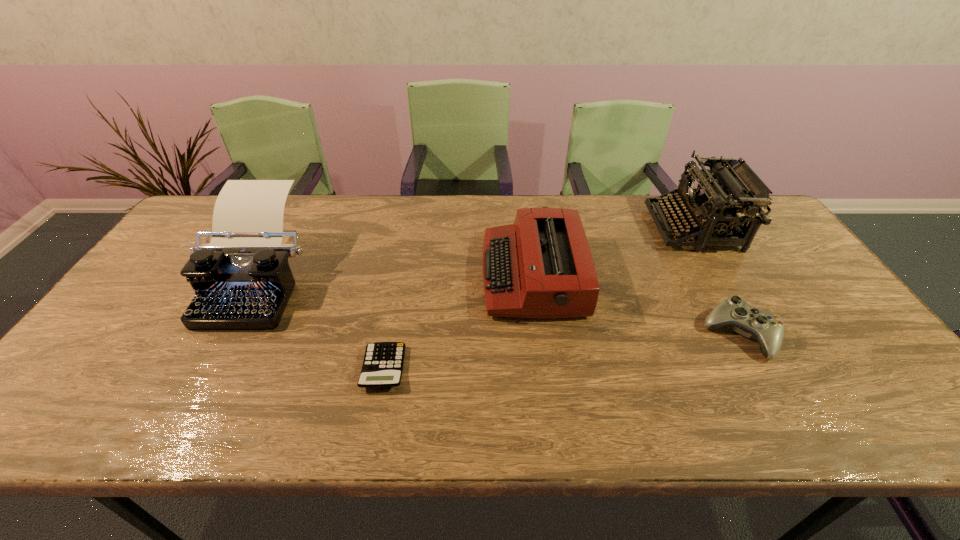
The width and height of the screenshot is (960, 540). I want to click on the rightmost typewriter, so click(x=731, y=187).

At what (x,y) coordinates should I click in order to perform the action: click on the leftmost typewriter. Please return your answer as a coordinate pair (x, y). Looking at the image, I should click on (242, 280).

Where is `the shortest typewriter`? This screenshot has width=960, height=540. the shortest typewriter is located at coordinates (541, 266).

I want to click on the third tallest object, so click(541, 266).

You are a GUI agent. You are given a task and a screenshot of the screen. Output one action in this format:
    pyautogui.click(x=<x>, y=<y>)
    Task: Click on the fourth tallest object
    
    Given the screenshot: What is the action you would take?
    [767, 327]

I want to click on the fourth object from right to left, so click(383, 362).

Find the location of a particular element. The height and width of the screenshot is (540, 960). the shortest object is located at coordinates (383, 362).

Where is `free space located 0.120m on the typing side of the rightmost typewriter`? Image resolution: width=960 pixels, height=540 pixels. free space located 0.120m on the typing side of the rightmost typewriter is located at coordinates (615, 228).

You are a GUI agent. You are given a task and a screenshot of the screen. Output one action in this format:
    pyautogui.click(x=<x>, y=<y>)
    Task: Click on the free space located 0.050m on the typing side of the rightmost typewriter
    Image resolution: width=960 pixels, height=540 pixels.
    Given the screenshot: What is the action you would take?
    pyautogui.click(x=637, y=228)

Locate an element on the screen. free region located 0.360m on the typing side of the rightmost typewriter is located at coordinates (541, 228).